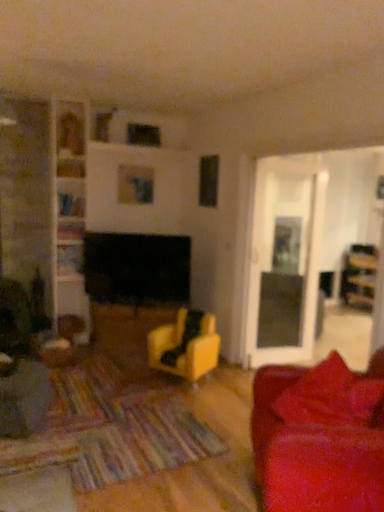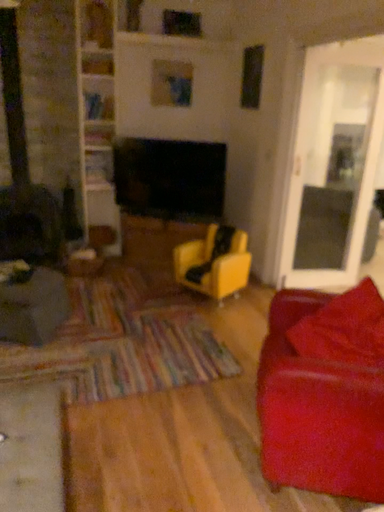
Question: How did the camera likely rotate when shooting the video?

Choices:
 (A) rotated downward
 (B) rotated upward

Answer: (A)